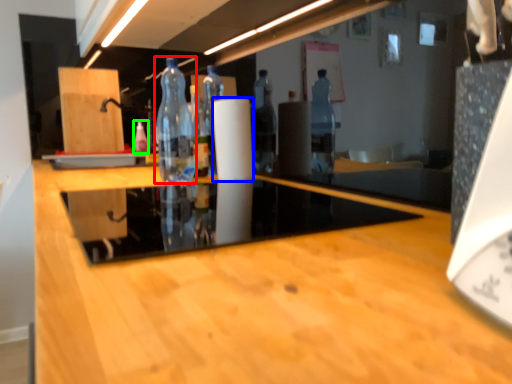
Question: Which is farther away from bottle (highlighted by a red box)? paper towel (highlighted by a blue box) or bottle (highlighted by a green box)?

Choices:
 (A) paper towel
 (B) bottle

Answer: (B)